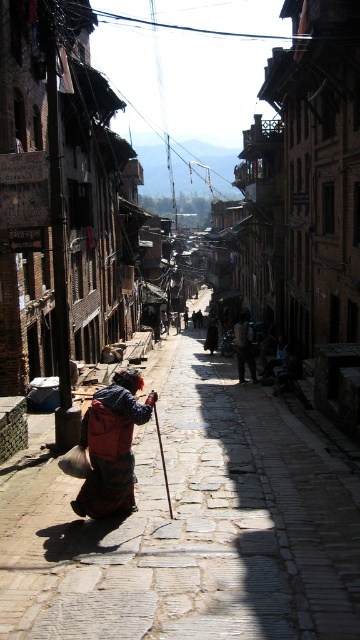
Does reddish-brown stone alley at center appear on the right side of red fabric backpack at lower left?

Correct, you'll find reddish-brown stone alley at center to the right of red fabric backpack at lower left.

Does reddish-brown stone alley at center have a larger size compared to red fabric backpack at lower left?

Correct, reddish-brown stone alley at center is larger in size than red fabric backpack at lower left.

Which is behind, point (78, 529) or point (141, 388)?

The point (141, 388) is more distant.

You are a GUI agent. You are given a task and a screenshot of the screen. Output one action in this format:
    pyautogui.click(x=<x>, y=<y>)
    Task: Click on the reddish-brown stone alley at center
    Image resolution: width=360 pixels, height=640 pixels.
    Given the screenshot: What is the action you would take?
    pyautogui.click(x=191, y=525)

Can you confirm if red fabric backpack at lower left is positioned to the right of dark brown leather jacket at center?

In fact, red fabric backpack at lower left is to the left of dark brown leather jacket at center.

Consider the image. Between red fabric backpack at lower left and dark brown leather jacket at center, which one is positioned higher?

dark brown leather jacket at center is above.

Where is `red fabric backpack at lower left`? The height and width of the screenshot is (640, 360). red fabric backpack at lower left is located at coordinates (111, 445).

Can you confirm if reddish-brown stone alley at center is positioned to the left of dark brown leather jacket at center?

Indeed, reddish-brown stone alley at center is positioned on the left side of dark brown leather jacket at center.

Locate an element on the screen. This screenshot has width=360, height=640. reddish-brown stone alley at center is located at coordinates (191, 525).